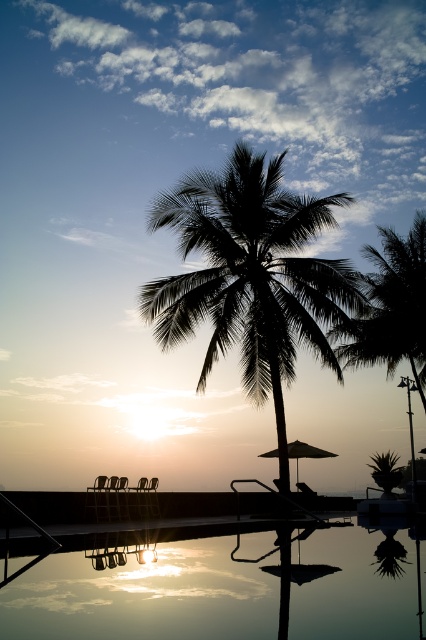
You are standing at the edge of the pool and want to know if the silhouette leafy palm at center is taller than the silhouette wooden beach chair at center. Can you confirm this?

The silhouette leafy palm at center is taller than the silhouette wooden beach chair at center, so yes, the palm is taller than the chair.

You are standing at the edge of the pool and want to place a floating ring in the transparent glass water at lower center. To avoid blocking the view of the matte beige umbrella at center, should you place the ring closer to or farther from the umbrella?

Since the transparent glass water at lower center is closer to the viewer than the matte beige umbrella at center, placing the floating ring closer to the umbrella would mean it is farther from you. This placement keeps the ring between you and the umbrella, potentially blocking its view. To avoid blocking the view, place the ring farther from the umbrella, which would be closer to you, ensuring the umbrella remains visible behind the water.

You are a guest at a tropical resort and want to place your beach chair between the silhouette palm tree at center and the matte beige umbrella at center. The beach chair requires 20 feet of space. Is there enough space between them?

The silhouette palm tree at center and the matte beige umbrella at center are 21.86 feet apart, so yes, there is enough space to place the beach chair between them since 21.86 feet is greater than the required 20 feet.